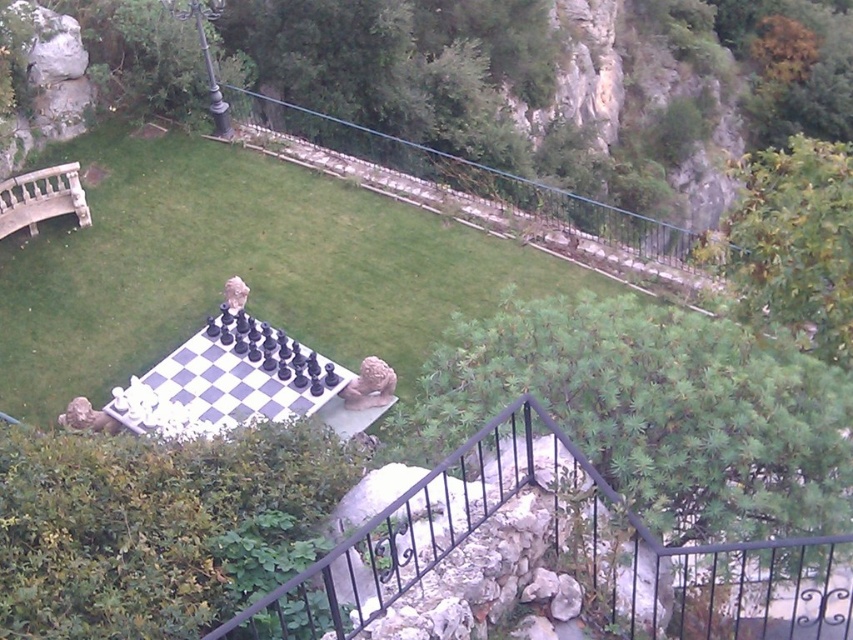
Does white glossy chess set at center come behind stone balustrade at left?

That is False.

Where is `white glossy chess set at center`? white glossy chess set at center is located at coordinates (235, 380).

Between point (132, 168) and point (320, 413), which one is positioned in front?

Point (320, 413)

Which is below, white stone chessboard at center or white glossy chess set at center?

white glossy chess set at center

This screenshot has height=640, width=853. What are the coordinates of `white stone chessboard at center` in the screenshot? It's located at (234, 266).

Looking at this image, can you confirm if white stone chessboard at center is thinner than stone balustrade at left?

No, white stone chessboard at center is not thinner than stone balustrade at left.

Does white stone chessboard at center have a greater height compared to stone balustrade at left?

Yes, white stone chessboard at center is taller than stone balustrade at left.

Find the location of a particular element. The width and height of the screenshot is (853, 640). white stone chessboard at center is located at coordinates (234, 266).